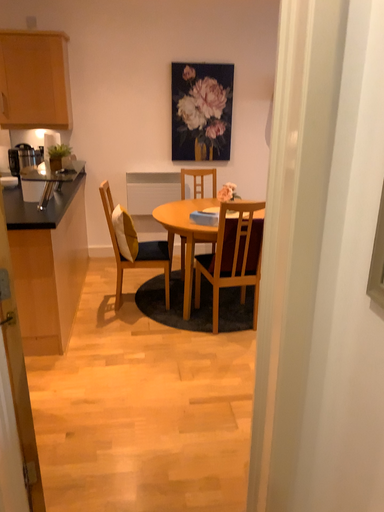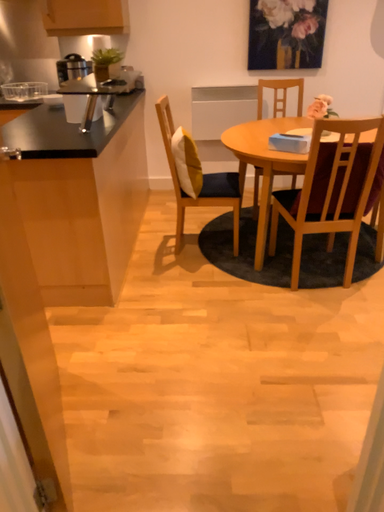
Question: Which way did the camera rotate in the video?

Choices:
 (A) rotated downward
 (B) rotated upward

Answer: (A)